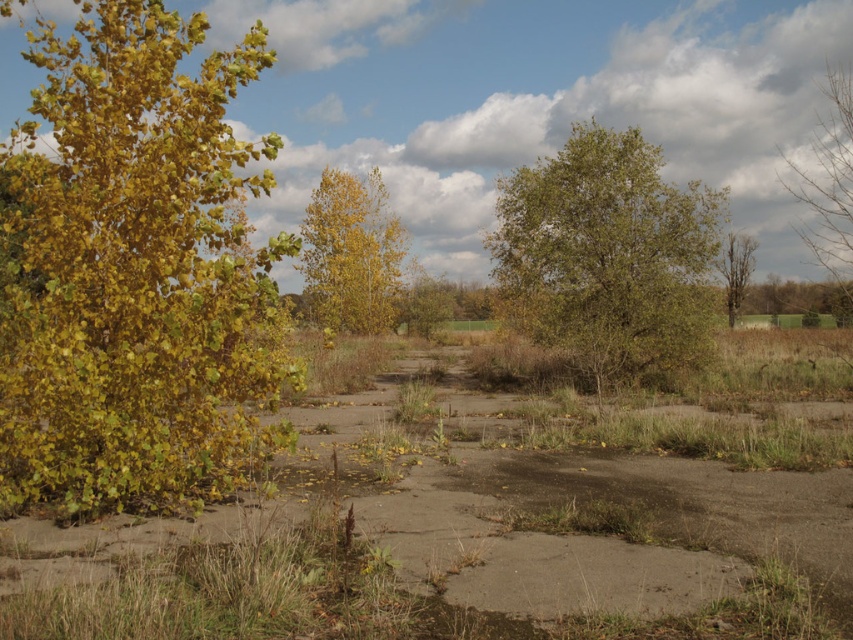
This screenshot has height=640, width=853. Identify the location of dull gray concrete at center. (492, 516).

Is point (741, 538) closer to viewer compared to point (751, 259)?

That is True.

Where is `dull gray concrete at center`? dull gray concrete at center is located at coordinates (492, 516).

Who is shorter, yellow-green leaves at left or bare wood tree at upper right?

Standing shorter between the two is bare wood tree at upper right.

Is yellow-green leaves at left positioned behind bare wood tree at upper right?

No.

Which is in front, point (271, 56) or point (848, 180)?

Point (271, 56)

Locate an element on the screen. yellow-green leaves at left is located at coordinates (132, 272).

Who is lower down, bare wood tree at upper right or bare wood tree at right?

Positioned lower is bare wood tree at right.

Does bare wood tree at upper right appear on the left side of bare wood tree at right?

In fact, bare wood tree at upper right is to the right of bare wood tree at right.

Where is `bare wood tree at upper right`? The height and width of the screenshot is (640, 853). bare wood tree at upper right is located at coordinates (828, 182).

The width and height of the screenshot is (853, 640). What are the coordinates of `bare wood tree at upper right` in the screenshot? It's located at (828, 182).